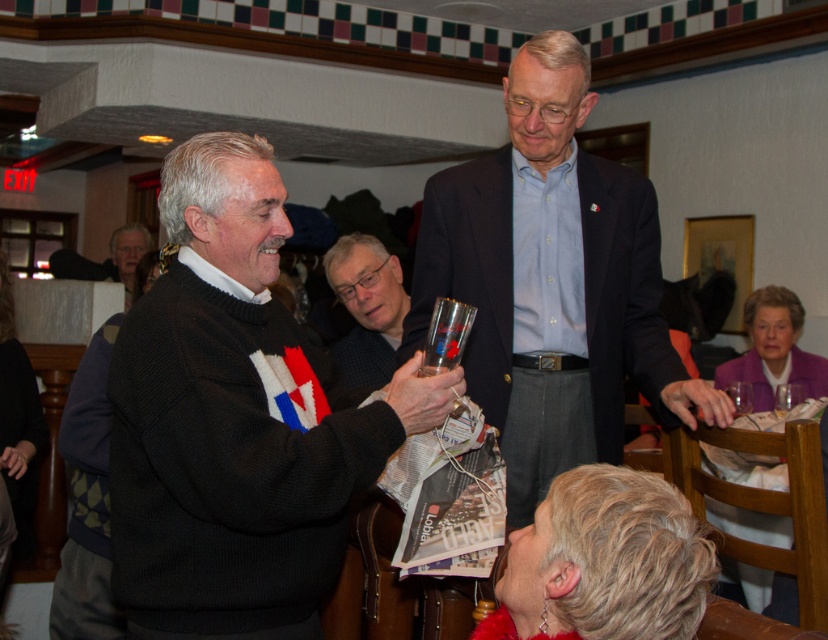
Question: Where is knitted sweater at center located in relation to matte gray sweater at center in the image?

Choices:
 (A) below
 (B) above

Answer: (A)

Question: Which point is closer to the camera?

Choices:
 (A) knitted sweater at center
 (B) light blue button-down shirt at center
 (C) matte gray sweater at center

Answer: (A)

Question: Does knitted sweater at center have a smaller size compared to matte gray sweater at center?

Choices:
 (A) yes
 (B) no

Answer: (B)

Question: Is knitted sweater at center thinner than light blue button-down shirt at center?

Choices:
 (A) no
 (B) yes

Answer: (B)

Question: Which object is farther from the camera taking this photo?

Choices:
 (A) knitted sweater at center
 (B) light blue button-down shirt at center

Answer: (B)

Question: Which object appears farthest from the camera in this image?

Choices:
 (A) light blue button-down shirt at center
 (B) matte gray sweater at center
 (C) knitted sweater at center

Answer: (B)